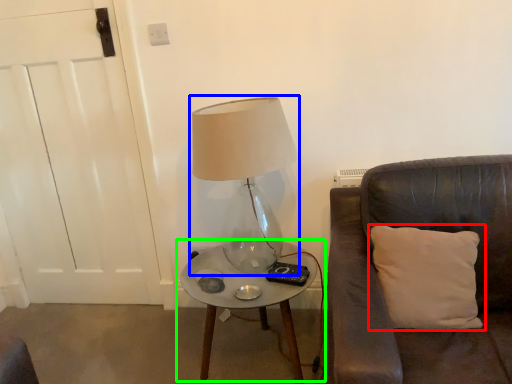
Question: Estimate the real-world distances between objects in this image. Which object is farther from pillow (highlighted by a red box), lamp (highlighted by a blue box) or table (highlighted by a green box)?

Choices:
 (A) lamp
 (B) table

Answer: (A)